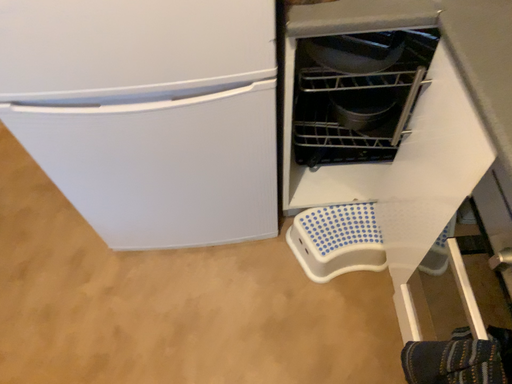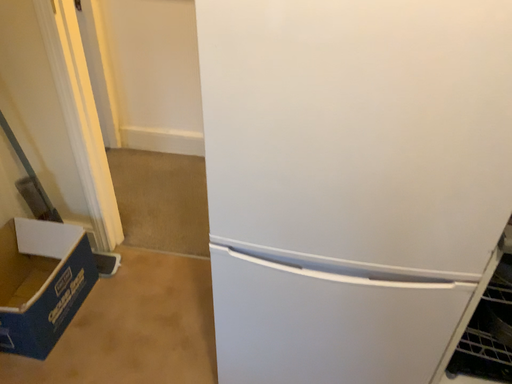
Question: Which way did the camera rotate in the video?

Choices:
 (A) rotated downward
 (B) rotated upward

Answer: (B)